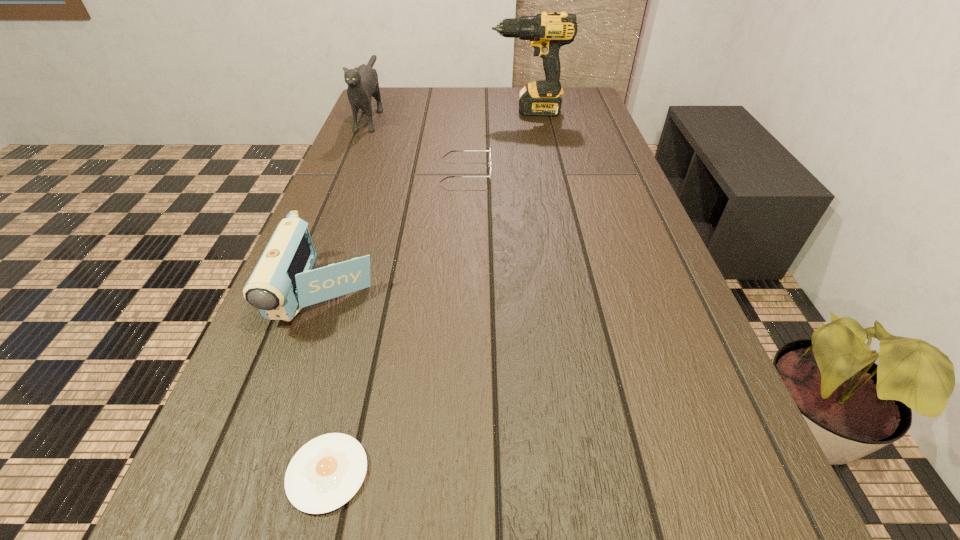
Locate an element on the screen. the tallest object is located at coordinates [x=547, y=32].

The image size is (960, 540). In order to click on the rightmost object in this screenshot , I will do `click(547, 32)`.

Locate an element on the screen. cat is located at coordinates (362, 81).

Where is `the third shortest object`? The height and width of the screenshot is (540, 960). the third shortest object is located at coordinates (283, 282).

Find the location of `the fourth farthest object`. the fourth farthest object is located at coordinates (283, 282).

This screenshot has width=960, height=540. What are the coordinates of `the second shortest object` in the screenshot? It's located at (490, 161).

Where is `the fourth object from left to right`? The width and height of the screenshot is (960, 540). the fourth object from left to right is located at coordinates (490, 161).

At what (x,y) coordinates should I click in order to perform the action: click on the shortest object. Please return your answer as a coordinate pair (x, y). This screenshot has width=960, height=540. Looking at the image, I should click on (325, 473).

Locate an element on the screen. This screenshot has width=960, height=540. egg yolk is located at coordinates (325, 473).

What are the coordinates of `free space located at the tip of the drill` in the screenshot? It's located at (439, 111).